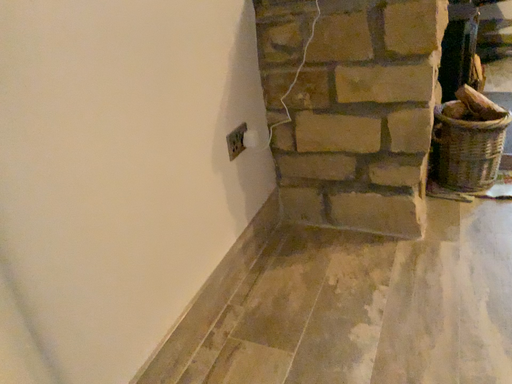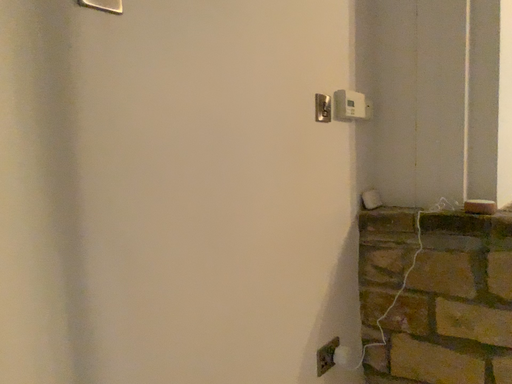
Question: Which way did the camera rotate in the video?

Choices:
 (A) rotated upward
 (B) rotated downward

Answer: (A)